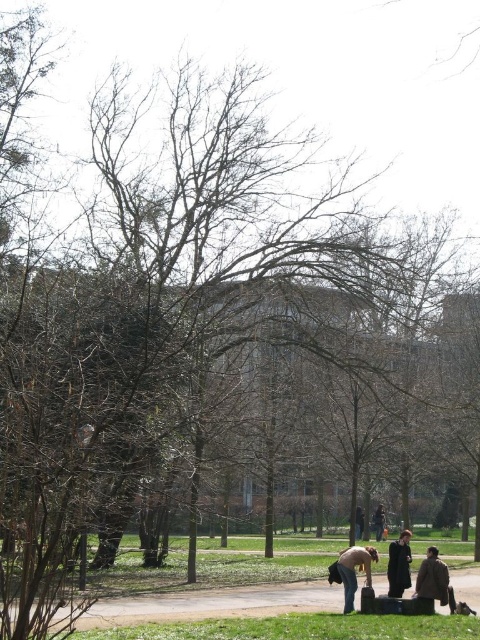
You are standing at the edge of the park and see both the brown wool coat at lower right and the dark brown leather jacket at lower center. If you need to retrieve both items, which one should you go to first if you want to minimize the total distance you walk?

You should go to the dark brown leather jacket at lower center first because it is closer to your starting position at the edge of the park than the brown wool coat at lower right, which is farther away.

You are a park visitor who wants to retrieve your coat from the lower right area. You see both the brown wool coat at lower right and the dark wool coat at lower right. Which coat should you pick up if you want the one that is nearest to you?

You should pick up the brown wool coat at lower right because it is closer to you than the dark wool coat at lower right.

You are a person carrying a large backpack and want to sit down on the green grass at lower center. However, there is a brown wool coat at lower right nearby. Which area has more space to accommodate your backpack?

The green grass at lower center has a larger width than the brown wool coat at lower right, so it can accommodate your backpack more comfortably.